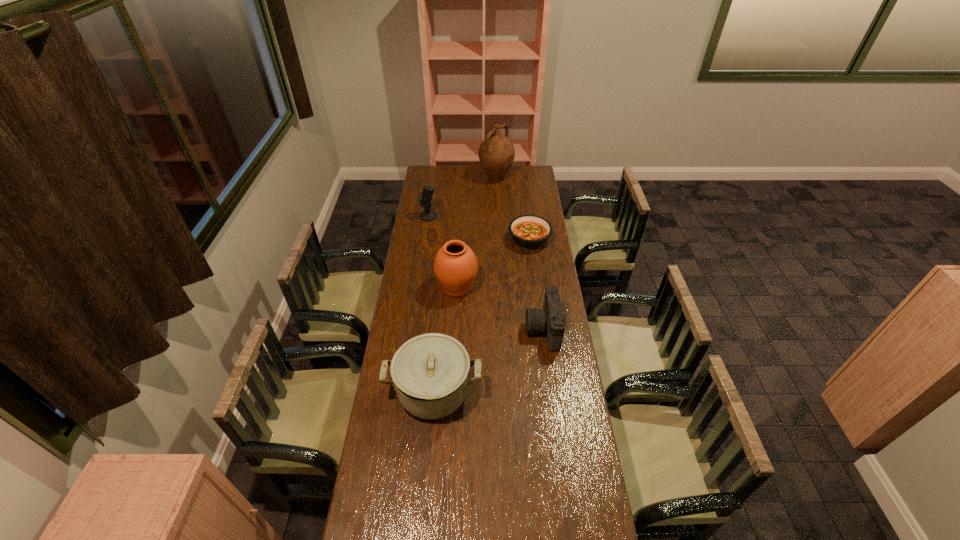
The width and height of the screenshot is (960, 540). In order to click on vacant area situated on the front of the tallest object in this screenshot , I will do 497,197.

You are a GUI agent. You are given a task and a screenshot of the screen. Output one action in this format:
    pyautogui.click(x=<x>, y=<y>)
    Task: Click on the vacant space located on the back of the fourth farthest object
    The image size is (960, 540).
    Given the screenshot: What is the action you would take?
    pyautogui.click(x=459, y=239)

Locate an element on the screen. The image size is (960, 540). free point located 0.170m on the right of the fifth nearest object is located at coordinates (468, 216).

Find the location of a particular element. free space located on the front of the nearest object is located at coordinates (425, 488).

In order to click on vacant area located at the lens of the fifth tallest object in this screenshot , I will do `click(470, 329)`.

Where is `free space located 0.370m at the lens of the fifth tallest object`? The height and width of the screenshot is (540, 960). free space located 0.370m at the lens of the fifth tallest object is located at coordinates (440, 329).

Locate an element on the screen. This screenshot has width=960, height=540. vacant space located 0.240m at the lens of the fifth tallest object is located at coordinates (470, 329).

The height and width of the screenshot is (540, 960). I want to click on free space located 0.130m on the left of the stew, so click(x=483, y=240).

Locate an element on the screen. This screenshot has height=540, width=960. object at the far edge is located at coordinates (496, 153).

Locate an element on the screen. Image resolution: width=960 pixels, height=540 pixels. urn located at the left edge is located at coordinates (455, 266).